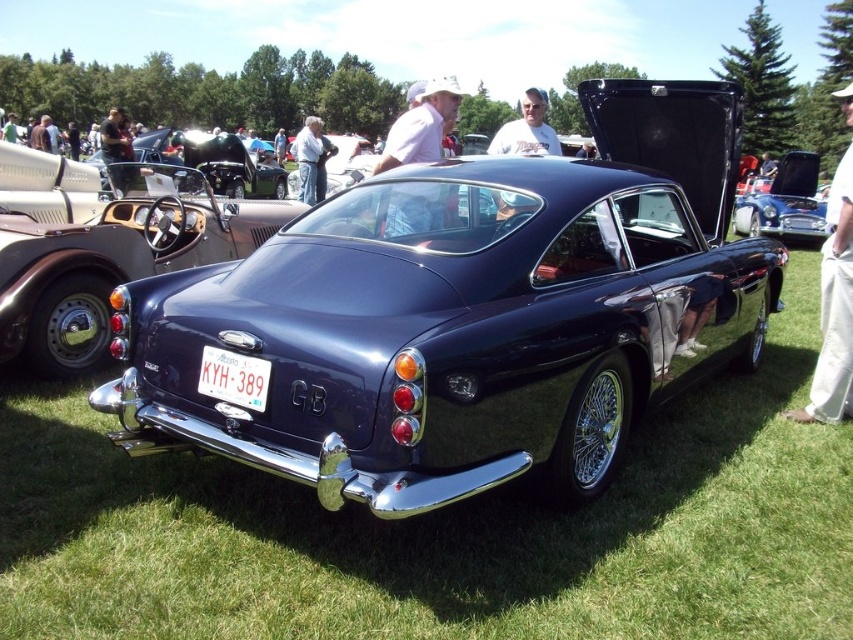
Question: Observing the image, what is the correct spatial positioning of glossy blue car at center in reference to white plastic license plate at center?

Choices:
 (A) right
 (B) left

Answer: (A)

Question: Is glossy blue car at center above white plastic license plate at center?

Choices:
 (A) yes
 (B) no

Answer: (A)

Question: Estimate the real-world distances between objects in this image. Which object is farther from the shiny black car at center?

Choices:
 (A) white plastic license plate at center
 (B) glossy blue car at center

Answer: (B)

Question: Which of the following is the farthest from the observer?

Choices:
 (A) (817, 221)
 (B) (234, 394)
 (C) (236, 177)

Answer: (C)

Question: Is shiny black car at center bigger than glossy blue car at center?

Choices:
 (A) no
 (B) yes

Answer: (B)

Question: Estimate the real-world distances between objects in this image. Which object is closer to the shiny black car at center?

Choices:
 (A) glossy blue car at center
 (B) white plastic license plate at center

Answer: (B)